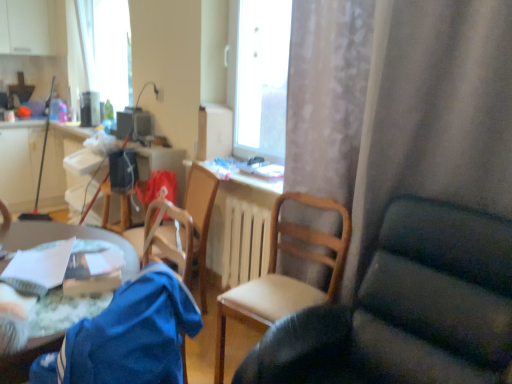
The image size is (512, 384). Describe the element at coordinates (165, 240) in the screenshot. I see `wooden chair at center` at that location.

The height and width of the screenshot is (384, 512). Describe the element at coordinates (63, 239) in the screenshot. I see `green fabric table at lower left` at that location.

Identify the location of wooden radiator at center. The height and width of the screenshot is (384, 512). (245, 242).

The height and width of the screenshot is (384, 512). In order to click on wooden chair at center in this screenshot , I will do point(165,240).

Considering the sizes of objects wooden chair at center, which appears as the first chair when viewed from the left, and matte plastic computer desk at left in the image provided, who is taller, wooden chair at center, which appears as the first chair when viewed from the left, or matte plastic computer desk at left?

Standing taller between the two is wooden chair at center, which appears as the first chair when viewed from the left.

Is wooden chair at center, the third chair in the right-to-left sequence, facing away from matte plastic computer desk at left?

No, wooden chair at center, the third chair in the right-to-left sequence, is not facing away from matte plastic computer desk at left.

Find the location of a particular element. The height and width of the screenshot is (384, 512). the 1st chair to the right of the matte plastic computer desk at left, starting your count from the anchor is located at coordinates (180, 229).

Can you confirm if wooden chair at center, the third chair in the right-to-left sequence, is smaller than matte plastic computer desk at left?

Yes, wooden chair at center, the third chair in the right-to-left sequence, is smaller than matte plastic computer desk at left.

Looking at this image, from a real-world perspective, is wooden chair at center, which is the third chair from left to right, over wooden radiator at center?

Yes.

Locate an element on the screen. The width and height of the screenshot is (512, 384). the 3rd chair located above the wooden radiator at center (from a real-world perspective) is located at coordinates (407, 309).

Between wooden chair at center, which is the third chair from left to right, and wooden radiator at center, which one appears on the right side from the viewer's perspective?

From the viewer's perspective, wooden chair at center, which is the third chair from left to right, appears more on the right side.

From the picture: From a real-world perspective, is wooden chair at center, marked as the second chair in a right-to-left arrangement, positioned above or below wooden chair at center?

wooden chair at center, marked as the second chair in a right-to-left arrangement, is below wooden chair at center.

Can you see wooden chair at center, marked as the second chair in a right-to-left arrangement, touching wooden chair at center?

wooden chair at center, marked as the second chair in a right-to-left arrangement, and wooden chair at center are clearly separated.

Considering the relative positions of wooden chair at center, the 2th chair from the left, and wooden chair at center in the image provided, is wooden chair at center, the 2th chair from the left, in front of wooden chair at center?

Yes, wooden chair at center, the 2th chair from the left, is in front of wooden chair at center.

Do you think wooden chair at center, arranged as the first chair when viewed from the right, is within wooden chair at center, marked as the second chair in a right-to-left arrangement, or outside of it?

wooden chair at center, arranged as the first chair when viewed from the right, exists outside the volume of wooden chair at center, marked as the second chair in a right-to-left arrangement.

Considering the sizes of objects wooden chair at center, arranged as the first chair when viewed from the right, and wooden chair at center, marked as the second chair in a right-to-left arrangement, in the image provided, who is wider, wooden chair at center, arranged as the first chair when viewed from the right, or wooden chair at center, marked as the second chair in a right-to-left arrangement,?

wooden chair at center, arranged as the first chair when viewed from the right.

From a real-world perspective, is wooden chair at center, arranged as the first chair when viewed from the right, physically located above or below wooden chair at center, the 2th chair from the left?

Clearly, from a real-world perspective, wooden chair at center, arranged as the first chair when viewed from the right, is above wooden chair at center, the 2th chair from the left.

From the image's perspective, does wooden chair at center, which is the third chair from left to right, appear lower than wooden chair at center, marked as the second chair in a right-to-left arrangement?

Indeed, from the image's perspective, wooden chair at center, which is the third chair from left to right, is shown beneath wooden chair at center, marked as the second chair in a right-to-left arrangement.

Which object is further away from the camera, wooden chair at center, arranged as the first chair when viewed from the right, or wooden chair at center?

wooden chair at center.

Is wooden chair at center, which is the third chair from left to right, wider or thinner than wooden chair at center?

Considering their sizes, wooden chair at center, which is the third chair from left to right, looks broader than wooden chair at center.

Can you see wooden chair at center, which is the third chair from left to right, touching wooden chair at center?

No, wooden chair at center, which is the third chair from left to right, is not making contact with wooden chair at center.

Is wooden chair at center, which is the third chair from left to right, to the left of wooden chair at center from the viewer's perspective?

Incorrect, wooden chair at center, which is the third chair from left to right, is not on the left side of wooden chair at center.

Between wooden chair at center and wooden chair at center, which is the third chair from left to right, which one has larger size?

wooden chair at center, which is the third chair from left to right.

Is wooden chair at center positioned far away from wooden chair at center, which is the third chair from left to right?

No, wooden chair at center is not far from wooden chair at center, which is the third chair from left to right.

From a real-world perspective, which is physically above, wooden chair at center or wooden chair at center, which is the third chair from left to right?

wooden chair at center is physically above.

Is wooden chair at center inside the boundaries of wooden chair at center, which is the third chair from left to right, or outside?

wooden chair at center is not inside wooden chair at center, which is the third chair from left to right, it's outside.

How many degrees apart are the facing directions of matte plastic computer desk at left and green fabric table at lower left?

matte plastic computer desk at left and green fabric table at lower left are facing 149 degrees away from each other.

Considering the sizes of objects matte plastic computer desk at left and green fabric table at lower left in the image provided, who is thinner, matte plastic computer desk at left or green fabric table at lower left?

matte plastic computer desk at left is thinner.

Is matte plastic computer desk at left facing towards green fabric table at lower left?

Yes.

The height and width of the screenshot is (384, 512). What are the coordinates of `table located in front of the matte plastic computer desk at left` in the screenshot? It's located at (63, 239).

Find the location of a particular element. This screenshot has width=512, height=384. computer desk that is behind the wooden chair at center, the third chair in the right-to-left sequence is located at coordinates (20, 162).

Starting from the wooden radiator at center, which chair is the 2nd one to the right? Please provide its 2D coordinates.

[(407, 309)]

Based on their spatial positions, is green fabric table at lower left or wooden chair at center, the 2th chair from the left, further from matte plastic computer desk at left?

Based on the image, wooden chair at center, the 2th chair from the left, appears to be further to matte plastic computer desk at left.

Looking at the image, which one is located further to wooden chair at center, which appears as the first chair when viewed from the left, wooden chair at center or matte plastic computer desk at left?

matte plastic computer desk at left is positioned further to the anchor wooden chair at center, which appears as the first chair when viewed from the left.

Which object lies further to the anchor point green fabric table at lower left, wooden chair at center, arranged as the first chair when viewed from the right, or matte plastic computer desk at left?

matte plastic computer desk at left.

When comparing their distances from green fabric table at lower left, does wooden chair at center, which is the third chair from left to right, or wooden radiator at center seem closer?

wooden chair at center, which is the third chair from left to right.

Looking at the image, which one is located further to green fabric table at lower left, wooden chair at center or wooden chair at center, marked as the second chair in a right-to-left arrangement?

wooden chair at center, marked as the second chair in a right-to-left arrangement, lies further to green fabric table at lower left than the other object.

From the image, which object appears to be farther from green fabric table at lower left, wooden radiator at center or wooden chair at center?

Among the two, wooden radiator at center is located further to green fabric table at lower left.

When comparing their distances from wooden chair at center, the third chair in the right-to-left sequence, does wooden chair at center or green fabric table at lower left seem closer?

Among the two, wooden chair at center is located nearer to wooden chair at center, the third chair in the right-to-left sequence.

Which object lies further to the anchor point wooden radiator at center, wooden chair at center, arranged as the first chair when viewed from the right, or wooden chair at center?

The object further to wooden radiator at center is wooden chair at center, arranged as the first chair when viewed from the right.

Image resolution: width=512 pixels, height=384 pixels. I want to click on armchair located between wooden chair at center, which appears as the first chair when viewed from the left, and wooden chair at center, the 2th chair from the left, in the left-right direction, so click(x=165, y=240).

This screenshot has width=512, height=384. What are the coordinates of `table between wooden chair at center, which is the third chair from left to right, and wooden chair at center in the front-back direction` in the screenshot? It's located at (63, 239).

You are a GUI agent. You are given a task and a screenshot of the screen. Output one action in this format:
    pyautogui.click(x=<x>, y=<y>)
    Task: Click on the table positioned between wooden chair at center, which is the third chair from left to right, and matte plastic computer desk at left from near to far
    
    Given the screenshot: What is the action you would take?
    pyautogui.click(x=63, y=239)

Locate an element on the screen. Image resolution: width=512 pixels, height=384 pixels. chair located between wooden chair at center, which is the third chair from left to right, and wooden chair at center in the depth direction is located at coordinates (283, 276).